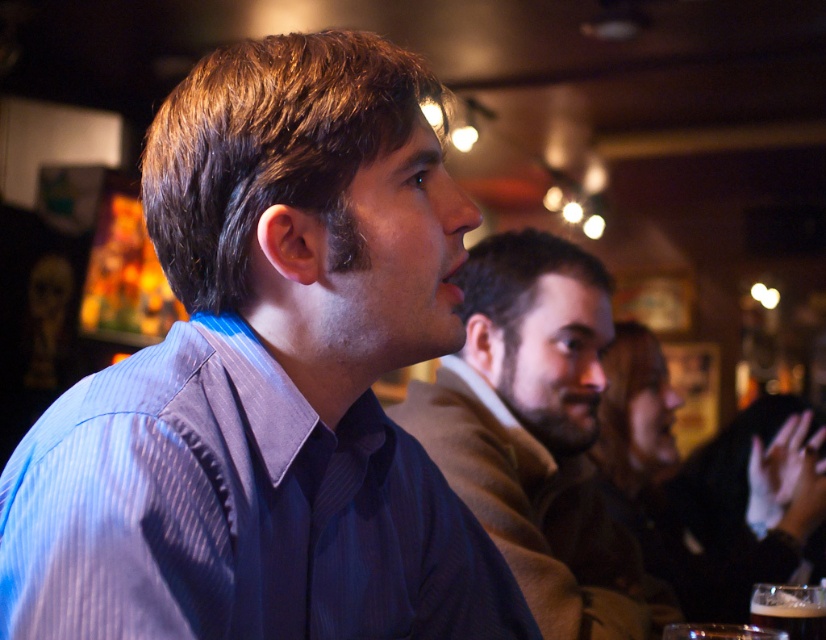
Which is below, matte blue shirt at center or dark brown glass at lower right?

dark brown glass at lower right is lower down.

Between point (558, 346) and point (810, 614), which one is positioned behind?

Positioned behind is point (558, 346).

The width and height of the screenshot is (826, 640). What do you see at coordinates (537, 435) in the screenshot?
I see `matte blue shirt at center` at bounding box center [537, 435].

Locate an element on the screen. The width and height of the screenshot is (826, 640). matte blue shirt at center is located at coordinates (537, 435).

Is blue striped shirt at center taller than matte blue shirt at center?

Incorrect, blue striped shirt at center's height is not larger of matte blue shirt at center's.

How far apart are blue striped shirt at center and matte blue shirt at center?

blue striped shirt at center and matte blue shirt at center are 71.21 centimeters apart.

What do you see at coordinates (268, 381) in the screenshot?
I see `blue striped shirt at center` at bounding box center [268, 381].

You are a GUI agent. You are given a task and a screenshot of the screen. Output one action in this format:
    pyautogui.click(x=<x>, y=<y>)
    Task: Click on the blue striped shirt at center
    Image resolution: width=826 pixels, height=640 pixels.
    Given the screenshot: What is the action you would take?
    pyautogui.click(x=268, y=381)

Can you confirm if blue striped shirt at center is positioned to the left of dark brown glass at lower right?

Correct, you'll find blue striped shirt at center to the left of dark brown glass at lower right.

What do you see at coordinates (268, 381) in the screenshot? I see `blue striped shirt at center` at bounding box center [268, 381].

Where is `blue striped shirt at center`? The image size is (826, 640). blue striped shirt at center is located at coordinates click(268, 381).